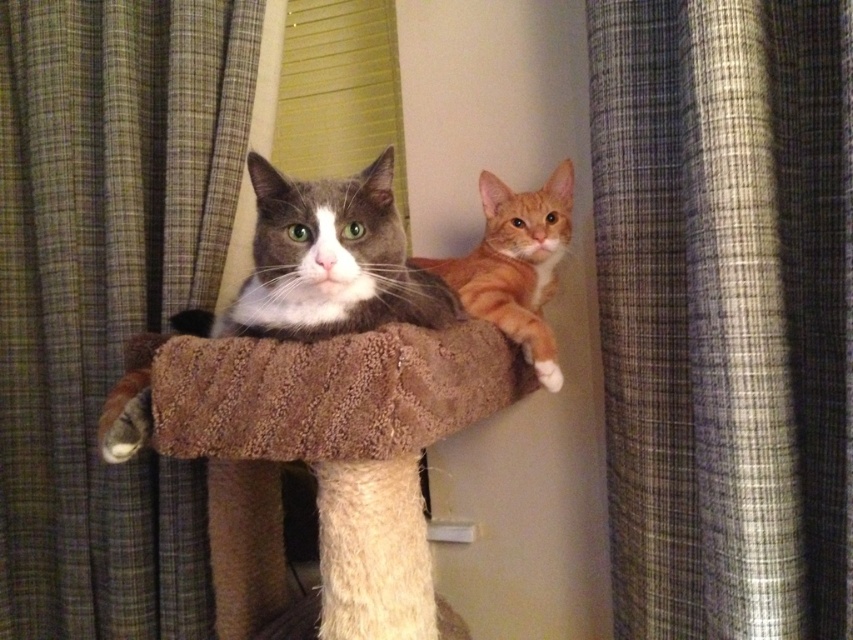
Question: Considering the relative positions of gray-white fur cat at center and orange fur cat at center in the image provided, where is gray-white fur cat at center located with respect to orange fur cat at center?

Choices:
 (A) left
 (B) right

Answer: (A)

Question: Which of the following is the farthest from the observer?

Choices:
 (A) brown textured cat bed at center
 (B) orange fur cat at center

Answer: (B)

Question: Is brown textured cat bed at center below gray and white plush cat at center?

Choices:
 (A) yes
 (B) no

Answer: (A)

Question: Is gray plaid curtain at right positioned behind gray and white plush cat at center?

Choices:
 (A) yes
 (B) no

Answer: (B)

Question: Among these objects, which one is farthest from the camera?

Choices:
 (A) gray and white plush cat at center
 (B) orange fur cat at center
 (C) brown textured cat bed at center
 (D) gray-white fur cat at center

Answer: (B)

Question: Which object is positioned closest to the orange fur cat at center?

Choices:
 (A) gray plaid curtain at right
 (B) green plaid curtain at left

Answer: (A)